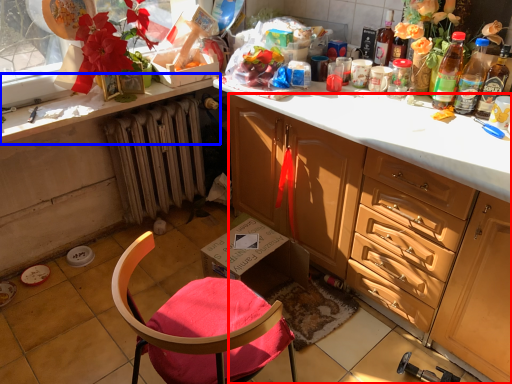
Question: Which object is further to the camera taking this photo, cabinetry (highlighted by a red box) or countertop (highlighted by a blue box)?

Choices:
 (A) cabinetry
 (B) countertop

Answer: (B)